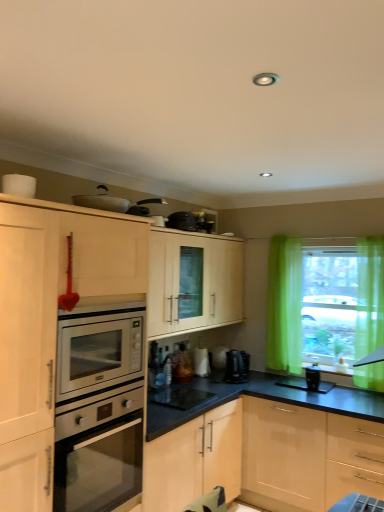
Where is `vacant space underneath black glossy coffee maker at center, positioned as the second appliance in back-to-front order (from a real-world perspective)`? vacant space underneath black glossy coffee maker at center, positioned as the second appliance in back-to-front order (from a real-world perspective) is located at coordinates (200, 399).